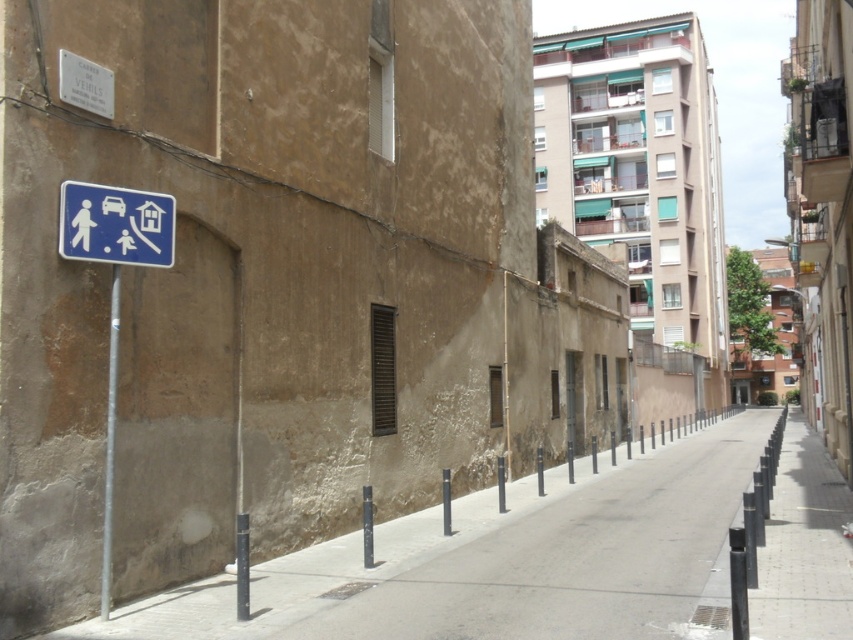
You are a delivery person trying to navigate through this street. You notice the blue plastic sign at upper left and the metallic pole at left. Which object is closer to you as you face the street?

The blue plastic sign at upper left is closer to you because it is in front of the metallic pole at left, meaning it is positioned nearer to your viewpoint.

You are a delivery person with a 24 inch wide box. You need to pass through the space between the blue plastic sign at upper left and the metallic pole at left. Can your box fit through that space?

The distance between the blue plastic sign at upper left and the metallic pole at left is 20.98 inches, which is narrower than the 24 inch wide box. Therefore, the box cannot fit through that space.

You are standing at the camera position and want to walk towards the two points marked in the image. Which point will you reach first, point (120,234) or point (114,276)?

Point (120,234) will be reached first because it is closer to the camera compared to point (114,276).